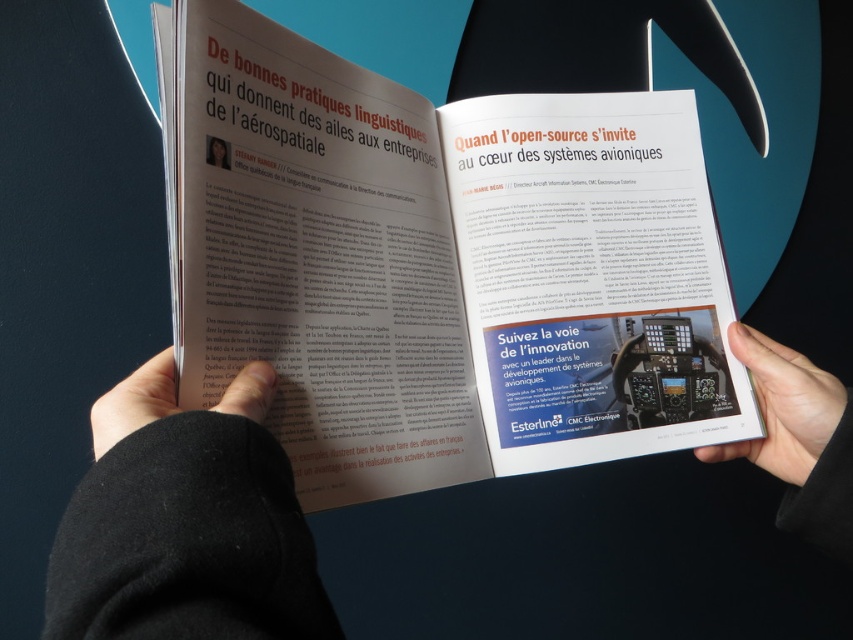
You are a photographer who wants to adjust the lighting on the black fabric hand at upper center. Since the hand is at point 0.819 on the horizontal axis and 0.218 on the vertical axis, where should you position the light to avoid shadows on the hand?

The black fabric hand at upper center is located at coordinates 0.819 horizontally and 0.218 vertically. To avoid casting shadows on the hand, position the light directly above or behind it so that light falls evenly without creating shadows.

You are a photographer reviewing the layout of this magazine spread. You notice the black matte hand at lower right and the black matte hand at lower left holding the magazine. Based on their positions, which hand is positioned higher up on the page?

The black matte hand at lower right is much taller as the black matte hand at lower left, so the black matte hand at lower right is positioned higher up on the page.

You are a photographer adjusting the focus on your camera. You notice two points in the image at coordinates point (491,476) and point (138,630). Which point should you focus on first to ensure the closest object is sharp?

Point (138,630) is closer to the camera than point (491,476), so you should focus on point (138,630) first to ensure the closest object is sharp.